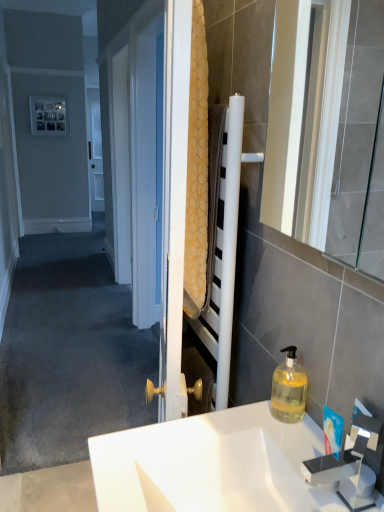
Question: Are translucent yellow liquid at lower right and white glossy sink at center beside each other?

Choices:
 (A) no
 (B) yes

Answer: (A)

Question: Is translucent yellow liquid at lower right thinner than white glossy sink at center?

Choices:
 (A) yes
 (B) no

Answer: (A)

Question: Considering the relative sizes of translucent yellow liquid at lower right and white glossy sink at center in the image provided, is translucent yellow liquid at lower right bigger than white glossy sink at center?

Choices:
 (A) no
 (B) yes

Answer: (A)

Question: From a real-world perspective, is translucent yellow liquid at lower right under white glossy sink at center?

Choices:
 (A) no
 (B) yes

Answer: (A)

Question: From the image's perspective, does translucent yellow liquid at lower right appear lower than white glossy sink at center?

Choices:
 (A) yes
 (B) no

Answer: (B)

Question: From the image's perspective, is translucent yellow liquid at lower right located above white glossy sink at center?

Choices:
 (A) yes
 (B) no

Answer: (A)

Question: Is translucent yellow liquid at lower right located within metallic silver picture frame at upper left?

Choices:
 (A) yes
 (B) no

Answer: (B)

Question: From a real-world perspective, is metallic silver picture frame at upper left below translucent yellow liquid at lower right?

Choices:
 (A) yes
 (B) no

Answer: (B)

Question: Is metallic silver picture frame at upper left not within translucent yellow liquid at lower right?

Choices:
 (A) no
 (B) yes

Answer: (B)

Question: Considering the relative sizes of metallic silver picture frame at upper left and translucent yellow liquid at lower right in the image provided, is metallic silver picture frame at upper left wider than translucent yellow liquid at lower right?

Choices:
 (A) no
 (B) yes

Answer: (A)

Question: Does metallic silver picture frame at upper left have a lesser height compared to translucent yellow liquid at lower right?

Choices:
 (A) no
 (B) yes

Answer: (A)

Question: Is metallic silver picture frame at upper left facing away from translucent yellow liquid at lower right?

Choices:
 (A) no
 (B) yes

Answer: (A)

Question: Considering the relative sizes of white glossy sink at center and white glossy mirror at right in the image provided, is white glossy sink at center wider than white glossy mirror at right?

Choices:
 (A) no
 (B) yes

Answer: (B)